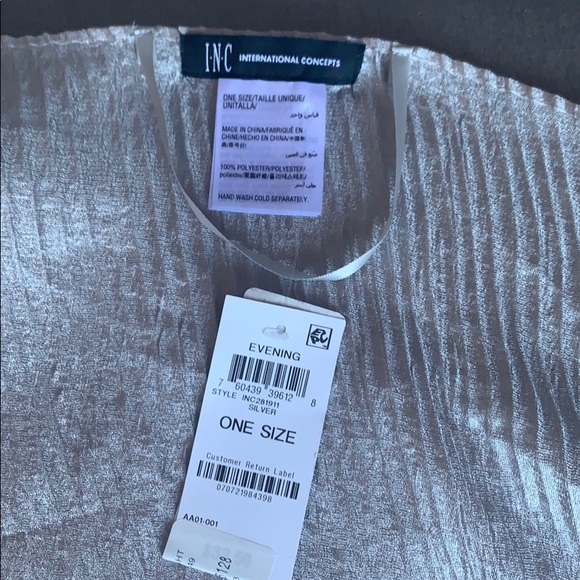
The height and width of the screenshot is (580, 580). I want to click on sticker, so click(235, 543).